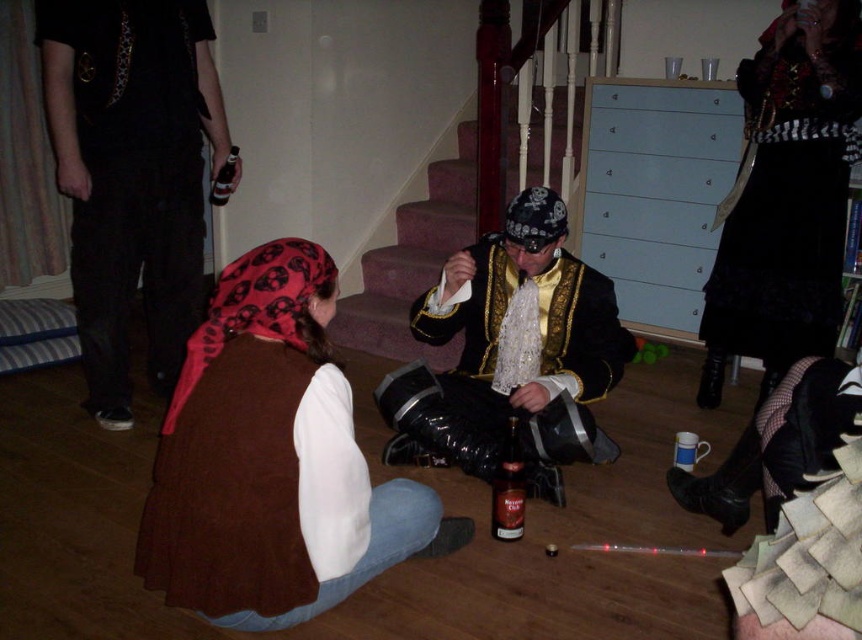
Question: Which is farther from the black lace skirt at lower right?

Choices:
 (A) brown fabric vest at lower left
 (B) black cotton pants at upper left

Answer: (B)

Question: Considering the real-world distances, which object is closest to the black cotton pants at upper left?

Choices:
 (A) brown fabric vest at lower left
 (B) gold embroidered jacket at center
 (C) black lace skirt at lower right

Answer: (B)

Question: In this image, where is black lace skirt at lower right located relative to gold embroidered jacket at center?

Choices:
 (A) left
 (B) right

Answer: (B)

Question: Does black cotton pants at upper left have a lesser width compared to gold embroidered jacket at center?

Choices:
 (A) yes
 (B) no

Answer: (A)

Question: Among these objects, which one is farthest from the camera?

Choices:
 (A) carpeted stairs at center
 (B) black cotton pants at upper left

Answer: (A)

Question: Is brown fabric vest at lower left below carpeted stairs at center?

Choices:
 (A) yes
 (B) no

Answer: (A)